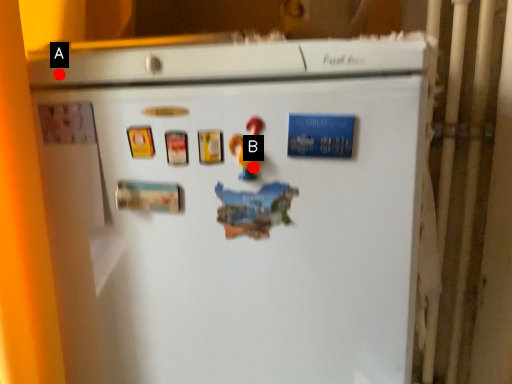
Question: Two points are circled on the image, labeled by A and B beside each circle. Which point is closer to the camera?

Choices:
 (A) A is closer
 (B) B is closer

Answer: (B)